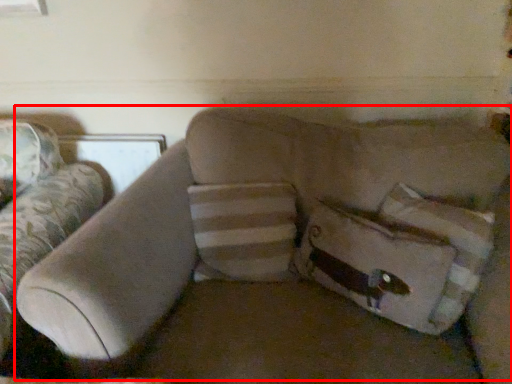
Question: From the image's perspective, where is couch (annotated by the red box) located relative to pillow?

Choices:
 (A) above
 (B) below

Answer: (B)